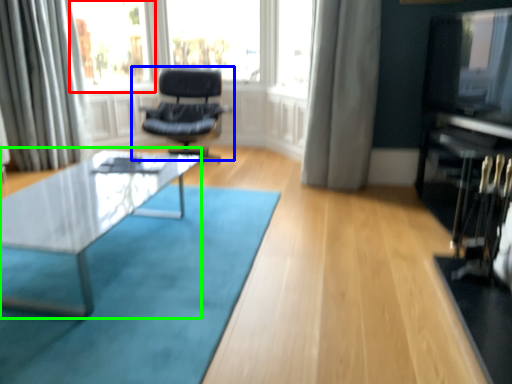
Question: Which object is the farthest from bay window (highlighted by a red box)? Choose among these: chair (highlighted by a blue box) or coffee table (highlighted by a green box).

Choices:
 (A) chair
 (B) coffee table

Answer: (B)